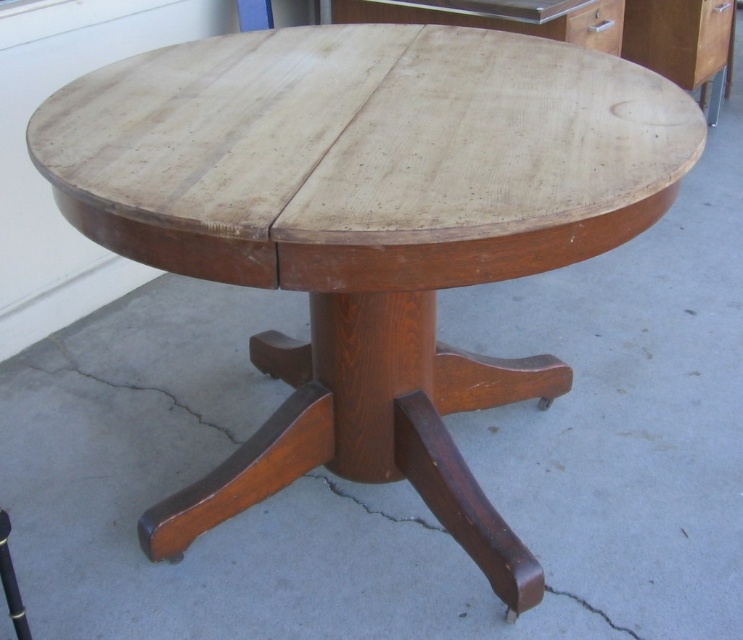
You are moving a 30 inch wide painting and need to place it between the glossy wood drawer at upper right and the matte wood drawer at upper right. Based on the scene, will the painting fit between them?

The glossy wood drawer at upper right is 28.07 inches away from matte wood drawer at upper right. Since the painting is 30 inches wide, it will not fit between them as the distance is shorter than the painting.